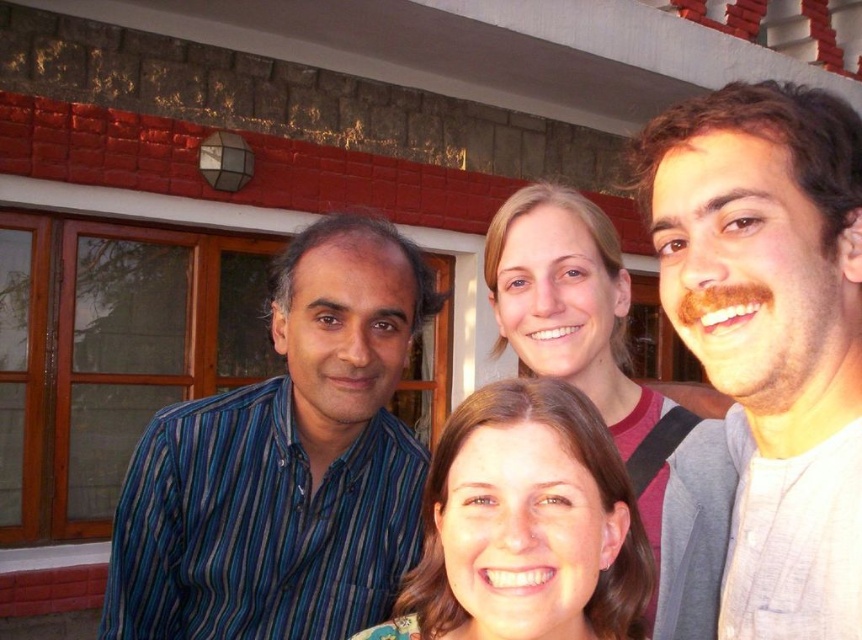
Question: Does blue striped shirt at left lie in front of smooth blonde hair at center?

Choices:
 (A) no
 (B) yes

Answer: (A)

Question: Does brown hair at center appear over smooth blonde hair at center?

Choices:
 (A) yes
 (B) no

Answer: (B)

Question: Which point is farther to the camera?

Choices:
 (A) (791, 374)
 (B) (594, 378)
 (C) (522, 452)

Answer: (B)

Question: Considering the real-world distances, which object is closest to the brown hair at center?

Choices:
 (A) gray cotton shirt at right
 (B) blue striped shirt at left

Answer: (A)

Question: Which object is positioned closest to the brown hair at center?

Choices:
 (A) gray cotton shirt at right
 (B) blue striped shirt at left

Answer: (A)

Question: In this image, where is gray cotton shirt at right located relative to brown hair at center?

Choices:
 (A) left
 (B) right

Answer: (B)